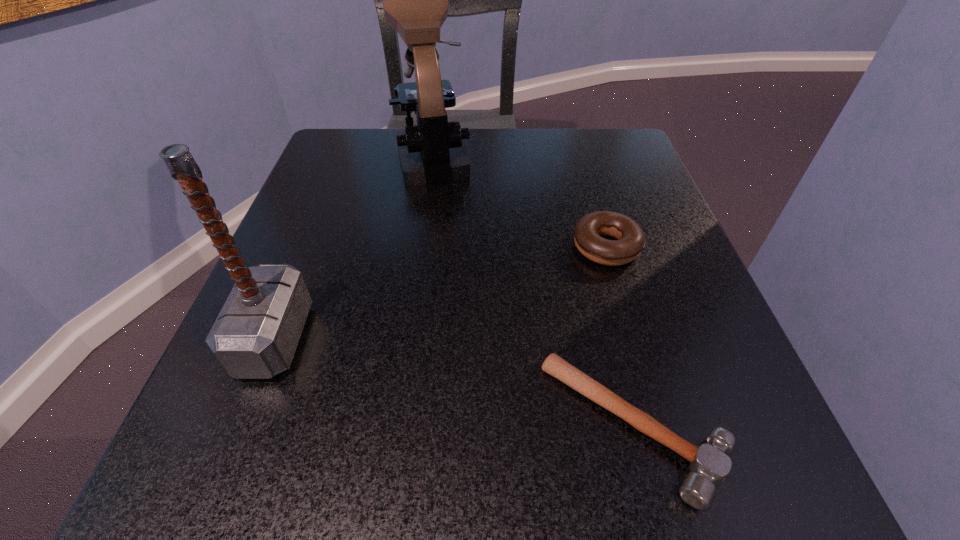
I want to click on microscope, so click(x=415, y=0).

What are the coordinates of `the third object from right to left` in the screenshot? It's located at (415, 0).

Where is `the leftmost object`? The image size is (960, 540). the leftmost object is located at coordinates (255, 335).

Locate an element on the screen. the taller hammer is located at coordinates (255, 335).

You are a GUI agent. You are given a task and a screenshot of the screen. Output one action in this format:
    pyautogui.click(x=<x>, y=<y>)
    Task: Click on the second shortest object
    Image resolution: width=960 pixels, height=540 pixels.
    Given the screenshot: What is the action you would take?
    pyautogui.click(x=630, y=242)

Where is `doughnut`? doughnut is located at coordinates (630, 242).

What are the coordinates of `the shorter hammer` in the screenshot? It's located at (709, 465).

Locate an element on the screen. This screenshot has width=960, height=540. the shortest object is located at coordinates (709, 465).

Where is `free space located 0.060m on the left of the microscope`? free space located 0.060m on the left of the microscope is located at coordinates (369, 154).

Locate an element on the screen. This screenshot has height=540, width=960. vacant region located 0.200m on the striking surface of the taller hammer is located at coordinates (446, 338).